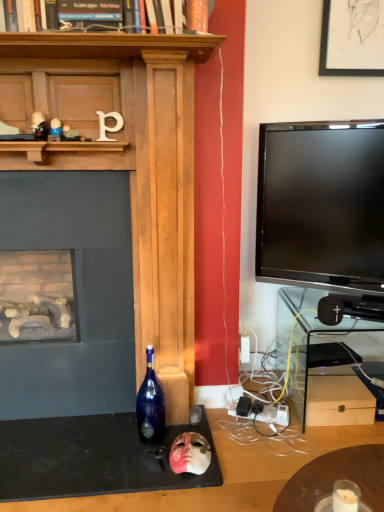
Question: In terms of size, does clear glass shelf at right appear bigger or smaller than black matte speaker at lower right?

Choices:
 (A) small
 (B) big

Answer: (B)

Question: Visually, is clear glass shelf at right positioned to the left or to the right of black matte speaker at lower right?

Choices:
 (A) right
 (B) left

Answer: (A)

Question: Based on their relative distances, which object is nearer to the pink matte mask at lower center, which appears as the fourth toy when viewed from the top?

Choices:
 (A) clear glass shelf at right
 (B) blue glass bottle at center
 (C) metallic black figurine at upper left, which is the fourth toy in right-to-left order
 (D) plastic toy at upper left, which is the second toy from top to bottom
 (E) metallic silver toy at upper center, acting as the 2th toy starting from the right

Answer: (B)

Question: Estimate the real-world distances between objects in this image. Which object is closer to the metallic silver toy at upper center, acting as the 2th toy starting from the right?

Choices:
 (A) clear glass shelf at right
 (B) blue glass bottle at center
 (C) black matte speaker at lower right
 (D) metallic black figurine at upper left, which is the fourth toy in right-to-left order
 (E) plastic toy at upper left, which is the third toy from right to left

Answer: (E)